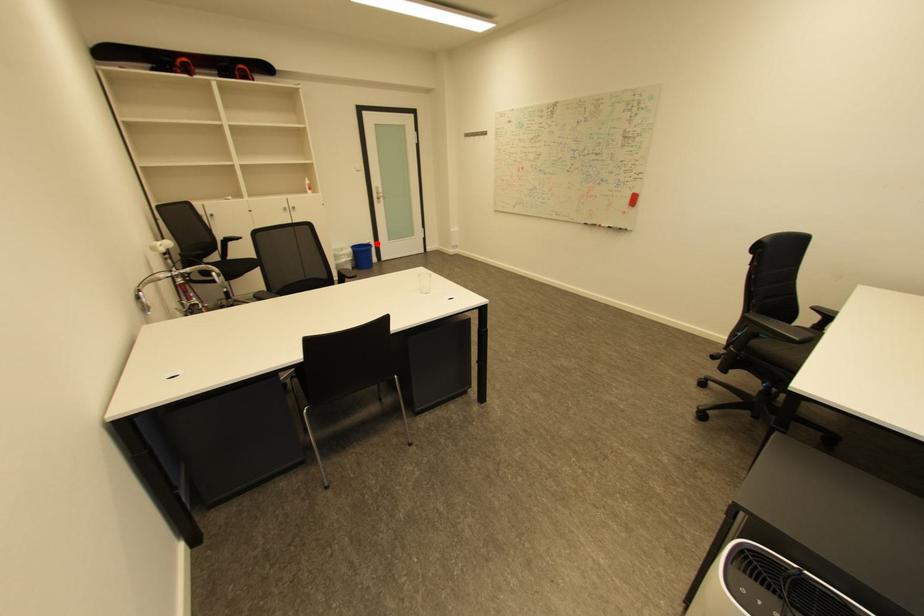
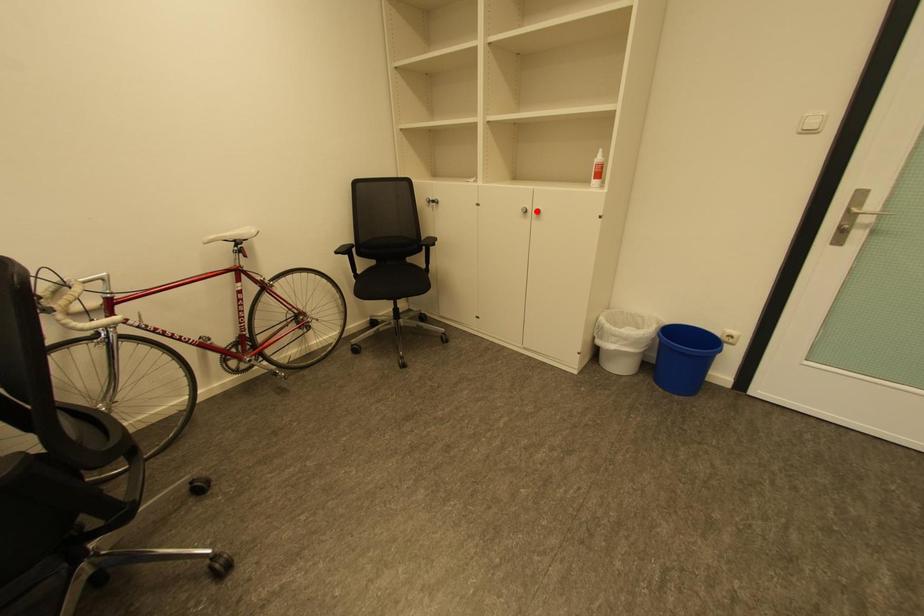
I am providing you with two images of the same scene from different viewpoints. A red point is marked on the first image and another point is marked on the second image. Is the red point in image1 aligned with the point shown in image2?

No